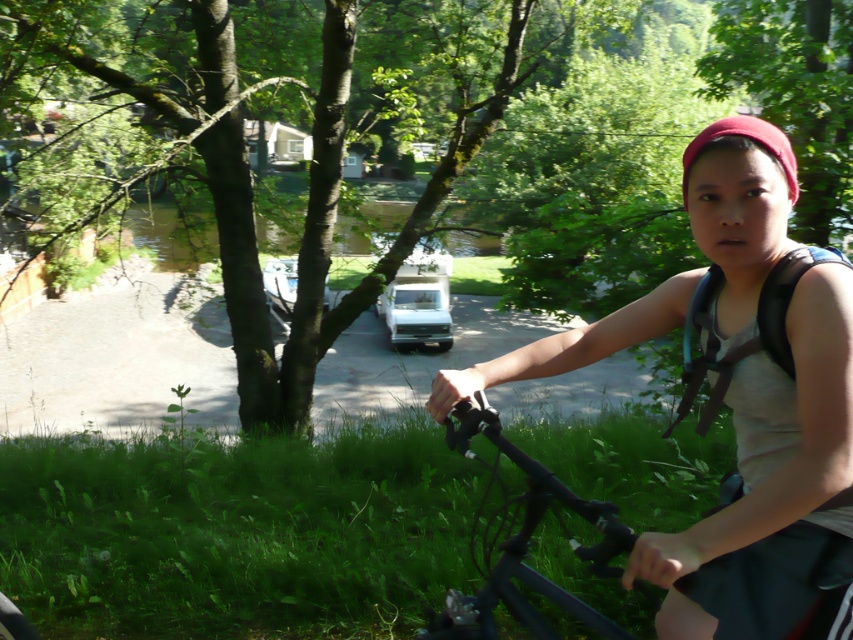
Question: Does black matte bicycle at center come in front of black fabric strap at right?

Choices:
 (A) no
 (B) yes

Answer: (B)

Question: Which of the following is the farthest from the observer?

Choices:
 (A) (486, 625)
 (B) (701, 433)
 (C) (756, 422)

Answer: (B)

Question: Which point is farther to the camera?

Choices:
 (A) matte gray tank top at center
 (B) black matte bicycle at center
 (C) black fabric strap at right

Answer: (C)

Question: Based on their relative distances, which object is nearer to the black matte bicycle at center?

Choices:
 (A) matte gray tank top at center
 (B) black fabric strap at right

Answer: (A)

Question: Can you confirm if black matte bicycle at center is positioned above black fabric strap at right?

Choices:
 (A) no
 (B) yes

Answer: (A)

Question: Can you confirm if matte gray tank top at center is positioned above black matte bicycle at center?

Choices:
 (A) no
 (B) yes

Answer: (B)